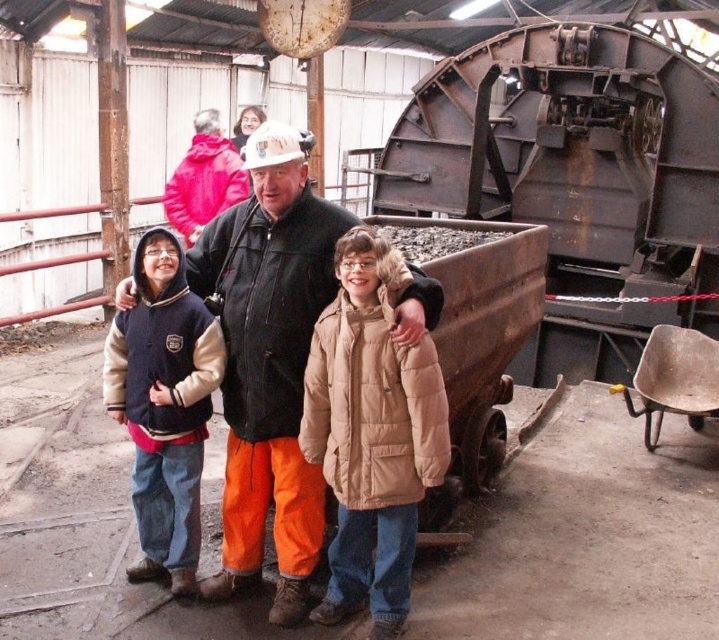
You are a photographer trying to capture a group photo of the matte black jacket at center and the tan puffy coat at center. Which one is more to the left in the image?

The matte black jacket at center is more to the left in the image because it is positioned on the left side of the tan puffy coat at center.

You are standing at the point labeled point (234, 355) and want to move to the point labeled point (193, 385). Which direction should you move to get closer to your destination?

To move from point (234, 355) to point (193, 385), you should move towards the direction that is away from the viewer since point (193, 385) is further away from the viewer compared to your current position at point (234, 355).

Based on the photo, you are standing at the origin point of the coordinate system. You want to move towards the tan puffy coat at center. What direction should you move in?

The tan puffy coat at center is located at coordinate point (370, 433), so you should move towards the right and slightly upward from your current position at the origin.